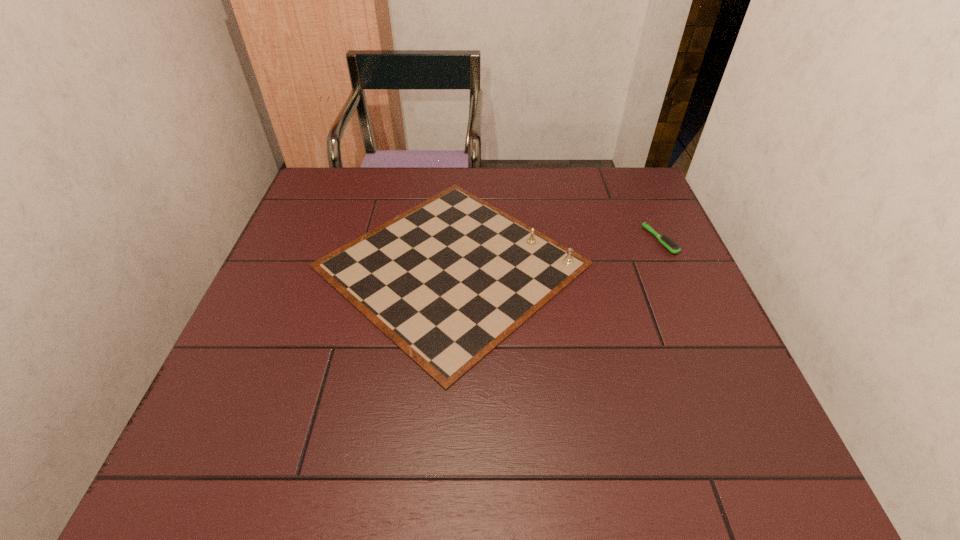
I want to click on vacant area at the far edge, so click(394, 209).

Locate an element on the screen. The height and width of the screenshot is (540, 960). vacant space at the left edge of the desktop is located at coordinates (258, 426).

Image resolution: width=960 pixels, height=540 pixels. I want to click on blank space at the right edge of the desktop, so click(697, 305).

In the image, there is a desktop. At what (x,y) coordinates should I click in order to perform the action: click on free space at the far left corner. Please return your answer as a coordinate pair (x, y). The height and width of the screenshot is (540, 960). Looking at the image, I should click on (353, 209).

Where is `blank space at the near left corner of the desktop`? This screenshot has height=540, width=960. blank space at the near left corner of the desktop is located at coordinates (180, 465).

The height and width of the screenshot is (540, 960). Identify the location of free space in the image that satisfies the following two spatial constraints: 1. on the back side of the hairbrush; 2. on the right side of the gameboard. tap(453, 240).

Identify the location of free spot that satisfies the following two spatial constraints: 1. on the back side of the right object; 2. on the left side of the left object. (453, 240).